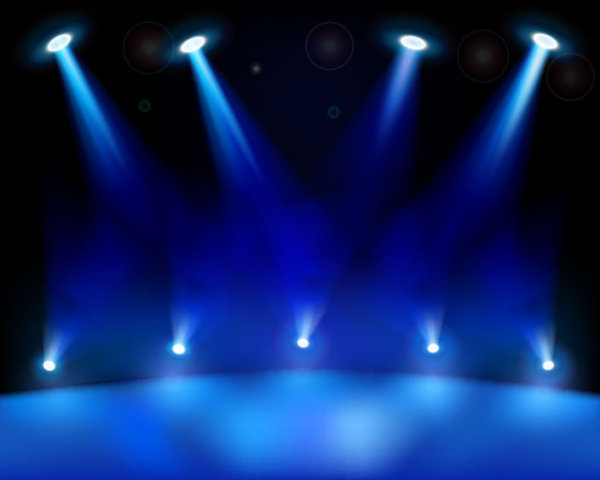
At what (x,y) coordinates should I click in order to perform the action: click on spotlight source. Please return your answer as a coordinate pair (x, y). This screenshot has width=600, height=480. Looking at the image, I should click on (55, 41), (194, 40), (415, 45), (548, 41), (45, 365), (180, 347), (304, 343), (432, 349), (551, 362).